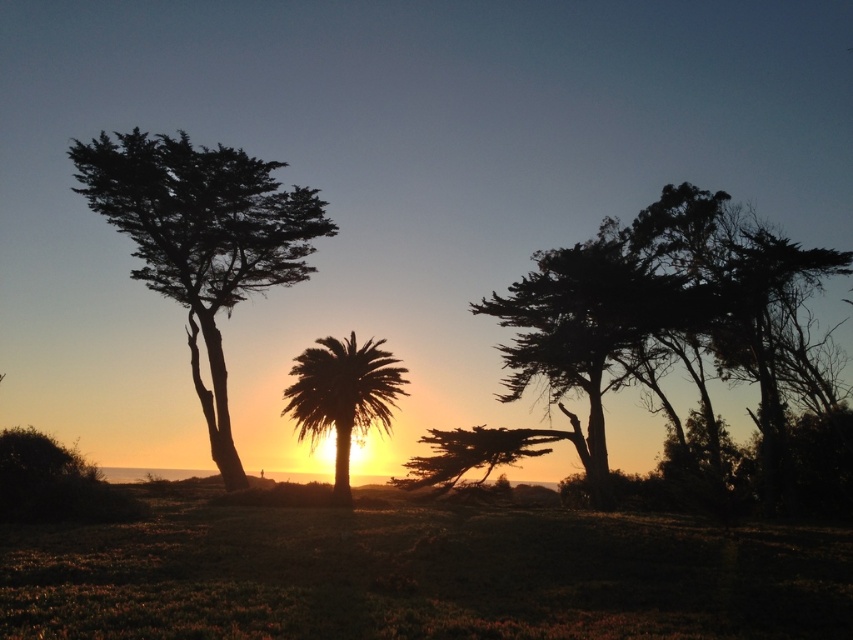
Question: Does silhouette wood tree at right have a lesser width compared to silhouette palm tree at center?

Choices:
 (A) no
 (B) yes

Answer: (A)

Question: Which of the following is the farthest from the observer?

Choices:
 (A) green grassy at lower center
 (B) silhouette palm tree at center

Answer: (B)

Question: Which point is farther to the camera?

Choices:
 (A) silhouette/leafy tree at left
 (B) silhouette wood tree at right

Answer: (A)

Question: From the image, what is the correct spatial relationship of silhouette/leafy tree at left in relation to silhouette palm tree at center?

Choices:
 (A) above
 (B) below

Answer: (A)

Question: Can you confirm if green grassy at lower center is bigger than silhouette palm tree at center?

Choices:
 (A) yes
 (B) no

Answer: (A)

Question: Which object is farther from the camera taking this photo?

Choices:
 (A) silhouette palm tree at center
 (B) green grassy at lower center
 (C) silhouette/leafy tree at left
 (D) silhouette wood tree at right

Answer: (C)